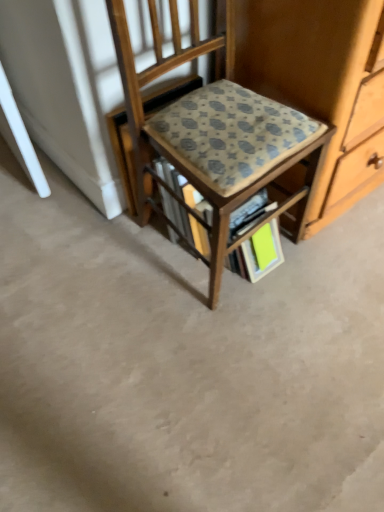
Describe the element at coordinates (259, 253) in the screenshot. The image size is (384, 512). I see `patterned fabric book at center` at that location.

What is the approximate height of bright green paper at lower center?

bright green paper at lower center is 5.83 inches in height.

You are a GUI agent. You are given a task and a screenshot of the screen. Output one action in this format:
    pyautogui.click(x=<x>, y=<y>)
    Task: Click on the patterned fabric book at center
    The height and width of the screenshot is (512, 384).
    Given the screenshot: What is the action you would take?
    pyautogui.click(x=259, y=253)

Is bright green paper at lower center thinner than patterned fabric book at center?

Correct, the width of bright green paper at lower center is less than that of patterned fabric book at center.

Is bright green paper at lower center positioned with its back to patterned fabric book at center?

Yes, bright green paper at lower center is facing away from patterned fabric book at center.

From their relative heights in the image, would you say bright green paper at lower center is taller or shorter than patterned fabric book at center?

In the image, bright green paper at lower center appears to be shorter than patterned fabric book at center.

From a real-world perspective, is patterned fabric book at center physically below patterned fabric chair at center?

Yes.

Is patterned fabric book at center completely or partially outside of patterned fabric chair at center?

No, patterned fabric book at center is not entirely external to patterned fabric chair at center.

Looking at this image, is patterned fabric book at center not near patterned fabric chair at center?

No, there isn't a large distance between patterned fabric book at center and patterned fabric chair at center.

Would you say bright green paper at lower center is a long distance from patterned fabric chair at center?

No, there isn't a large distance between bright green paper at lower center and patterned fabric chair at center.

Which object is further away from the camera, bright green paper at lower center or patterned fabric chair at center?

bright green paper at lower center.

Which of these two, bright green paper at lower center or patterned fabric chair at center, stands taller?

patterned fabric chair at center.

Is bright green paper at lower center at the right side of patterned fabric chair at center?

Indeed, bright green paper at lower center is positioned on the right side of patterned fabric chair at center.

From a real-world perspective, between patterned fabric book at center and bright green paper at lower center, who is vertically lower?

In real-world perspective, bright green paper at lower center is lower.

Considering the relative sizes of patterned fabric book at center and bright green paper at lower center in the image provided, is patterned fabric book at center taller than bright green paper at lower center?

Correct, patterned fabric book at center is much taller as bright green paper at lower center.

Consider the image. Between patterned fabric book at center and bright green paper at lower center, which one has smaller size?

bright green paper at lower center.

Is the depth of patterned fabric book at center greater than that of bright green paper at lower center?

No, patterned fabric book at center is closer to the camera.

In order to click on chair in front of the bright green paper at lower center in this screenshot , I will do `click(213, 134)`.

Is patterned fabric chair at center at the right side of bright green paper at lower center?

No.

Is patterned fabric chair at center taller or shorter than bright green paper at lower center?

Considering their sizes, patterned fabric chair at center has more height than bright green paper at lower center.

Between patterned fabric chair at center and patterned fabric book at center, which one has smaller size?

patterned fabric book at center.

Considering the sizes of patterned fabric chair at center and patterned fabric book at center in the image, is patterned fabric chair at center taller or shorter than patterned fabric book at center?

Considering their sizes, patterned fabric chair at center has more height than patterned fabric book at center.

Would you say patterned fabric chair at center is outside patterned fabric book at center?

Yes, patterned fabric chair at center is not within patterned fabric book at center.

Which object is positioned more to the right, patterned fabric chair at center or patterned fabric book at center?

patterned fabric book at center.

Locate an element on the screen. book above the bright green paper at lower center (from a real-world perspective) is located at coordinates (259, 253).

At what (x,y) coordinates should I click in order to perform the action: click on chair in front of the patterned fabric book at center. Please return your answer as a coordinate pair (x, y). This screenshot has height=512, width=384. Looking at the image, I should click on (213, 134).

Which object lies further to the anchor point patterned fabric book at center, bright green paper at lower center or patterned fabric chair at center?

Among the two, patterned fabric chair at center is located further to patterned fabric book at center.

Estimate the real-world distances between objects in this image. Which object is further from patterned fabric chair at center, patterned fabric book at center or bright green paper at lower center?

Based on the image, bright green paper at lower center appears to be further to patterned fabric chair at center.

When comparing their distances from bright green paper at lower center, does patterned fabric chair at center or patterned fabric book at center seem further?

patterned fabric chair at center.

Looking at the image, which one is located closer to patterned fabric book at center, patterned fabric chair at center or bright green paper at lower center?

Based on the image, bright green paper at lower center appears to be nearer to patterned fabric book at center.

Which object lies further to the anchor point bright green paper at lower center, patterned fabric book at center or patterned fabric chair at center?

patterned fabric chair at center lies further to bright green paper at lower center than the other object.

Considering their positions, is bright green paper at lower center positioned further to patterned fabric chair at center than patterned fabric book at center?

The object further to patterned fabric chair at center is bright green paper at lower center.

The width and height of the screenshot is (384, 512). I want to click on book between patterned fabric chair at center and bright green paper at lower center along the z-axis, so click(x=259, y=253).